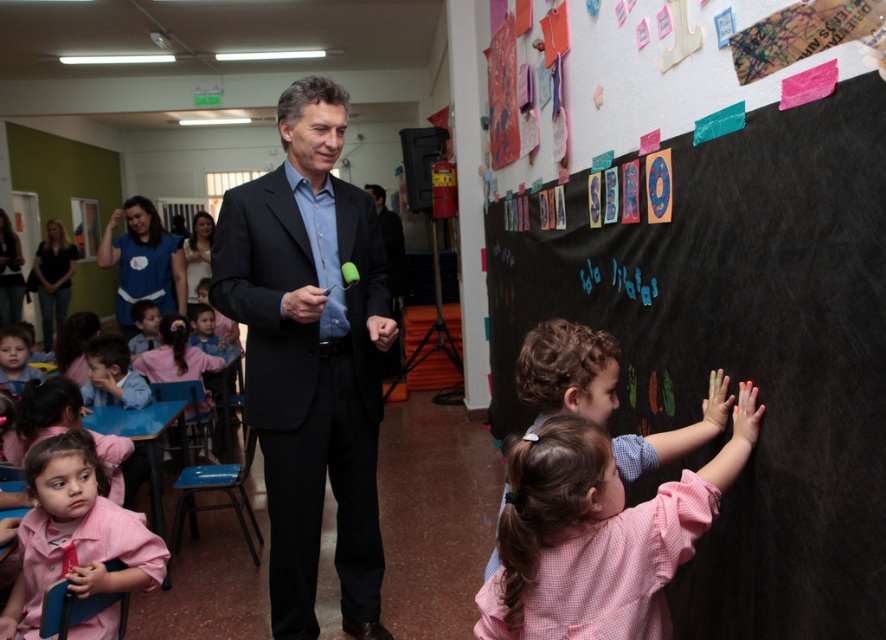
You are standing at the entrance of the classroom and want to move towards the point labeled as point (766, 509). However, there is an obstacle at point (86, 458). Will you need to go around the obstacle to reach your destination?

Point (766, 509) is in front of point (86, 458), so you can move straight towards point (766, 509) without needing to go around the obstacle at point (86, 458) since it is behind your path.

You are a photographer trying to capture a candid shot of the matte black suit at center and the pink gingham shirt at center. Since you want both subjects to appear in focus, which one should you adjust your camera focus closer to?

The matte black suit at center is larger in size compared to the pink gingham shirt at center. To ensure both are in focus, you should adjust your camera focus closer to the matte black suit at center because it is the larger object and requires more precise focus to capture details.

You are a teacher in the classroom and need to place a 30 cm wide ruler between the black chalkboard at center and the pink gingham shirt at center. Is there enough space to fit the ruler horizontally between them?

The black chalkboard at center and pink gingham shirt at center are 40.35 centimeters apart from each other. Since the ruler is 30 cm wide, it can fit horizontally between them as there is sufficient space.